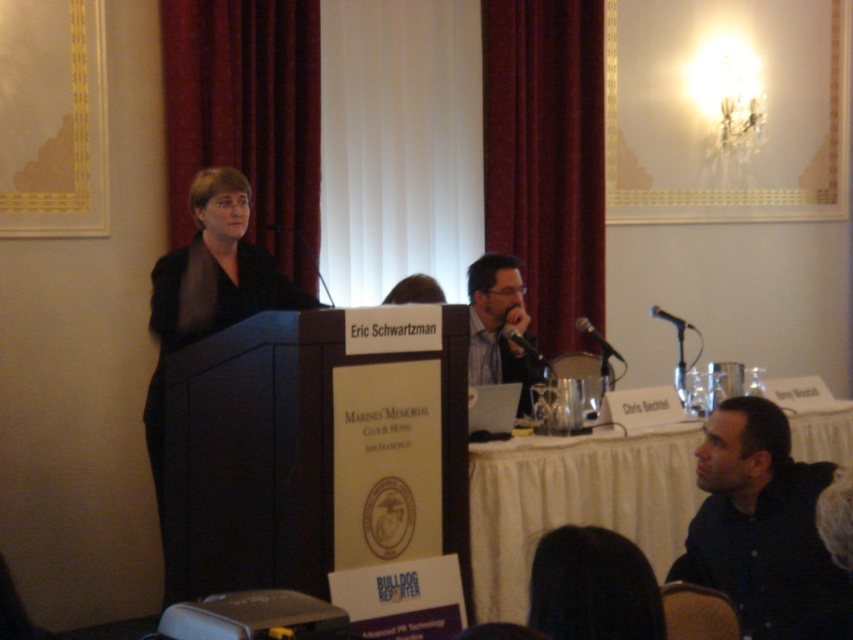
Between burgundy velvet curtain at center and matte black shirt at center, which one is positioned lower?

matte black shirt at center is below.

Does point (567, 330) lie behind point (486, 276)?

Yes, point (567, 330) is behind point (486, 276).

You are a GUI agent. You are given a task and a screenshot of the screen. Output one action in this format:
    pyautogui.click(x=<x>, y=<y>)
    Task: Click on the burgundy velvet curtain at center
    
    Given the screenshot: What is the action you would take?
    pyautogui.click(x=546, y=157)

Who is positioned more to the left, burgundy velvet curtain at center or dark red velvet curtain at upper center?

dark red velvet curtain at upper center

Does burgundy velvet curtain at center lie in front of dark red velvet curtain at upper center?

No, it is behind dark red velvet curtain at upper center.

Which is in front, point (601, 148) or point (292, 67)?

Positioned in front is point (292, 67).

Locate an element on the screen. burgundy velvet curtain at center is located at coordinates (546, 157).

Is dark red velvet curtain at upper center to the right of black fabric at left from the viewer's perspective?

Incorrect, dark red velvet curtain at upper center is not on the right side of black fabric at left.

Is the position of dark red velvet curtain at upper center less distant than that of black fabric at left?

That is False.

Which is behind, point (238, 44) or point (229, 276)?

The point (238, 44) is more distant.

I want to click on dark red velvet curtain at upper center, so click(x=247, y=115).